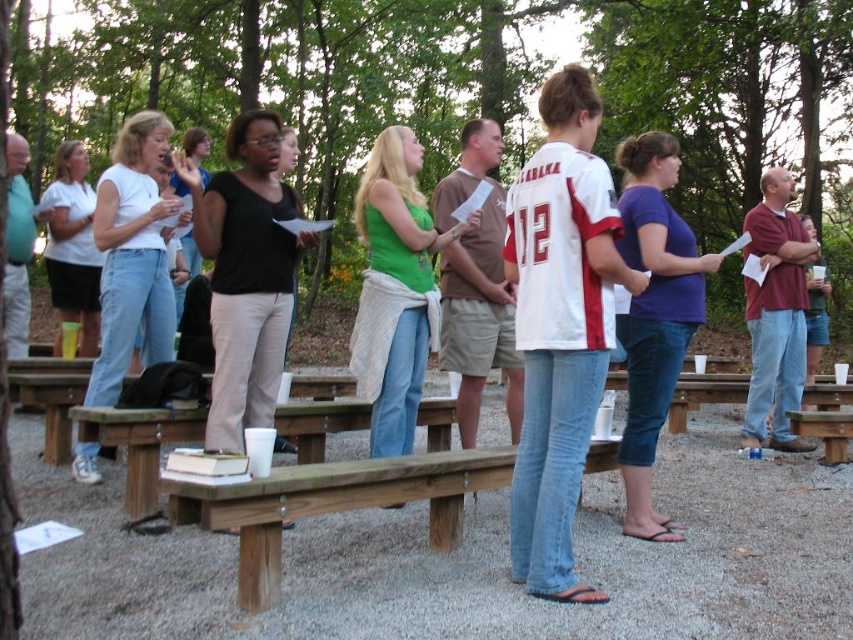
You are standing at the origin point of the coordinate system in the image. Where is the brown wooden bench at center located in terms of coordinates?

The brown wooden bench at center is located at coordinates point (334, 502).

You are a photographer standing at the center of the park. You want to take a photo of the two brown wooden benches mentioned. How far apart are the brown wooden bench at center and the brown wooden bench at lower right?

The brown wooden bench at center is 3.25 meters from brown wooden bench at lower right.